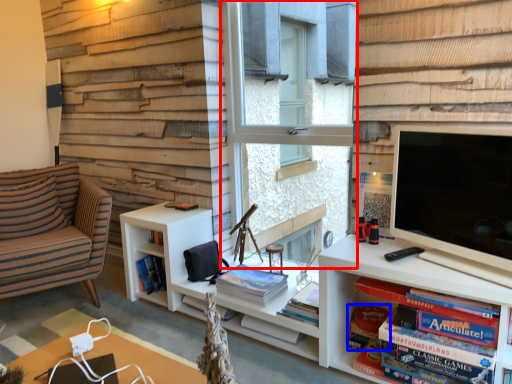
Question: Among these objects, which one is farthest to the camera, window (highlighted by a red box) or paperback book (highlighted by a blue box)?

Choices:
 (A) window
 (B) paperback book

Answer: (A)